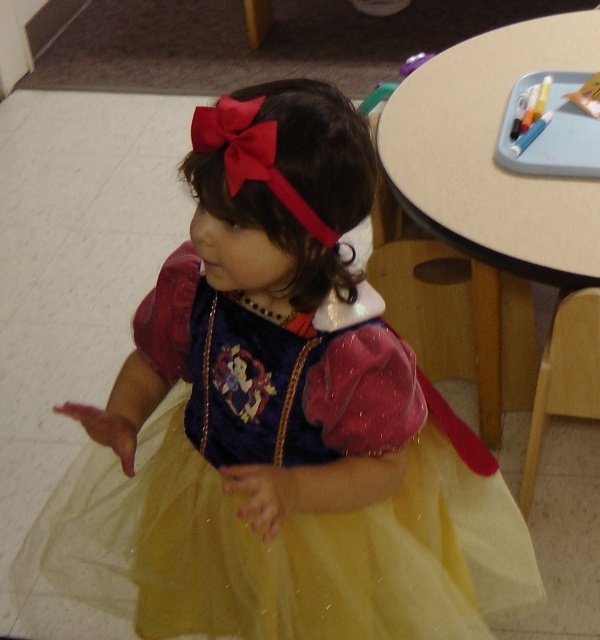
The width and height of the screenshot is (600, 640). What do you see at coordinates (285, 518) in the screenshot? I see `yellow tulle dress at center` at bounding box center [285, 518].

Can you confirm if yellow tulle dress at center is positioned to the left of beige laminate table at upper right?

Correct, you'll find yellow tulle dress at center to the left of beige laminate table at upper right.

Where is `yellow tulle dress at center`? The image size is (600, 640). yellow tulle dress at center is located at coordinates (285, 518).